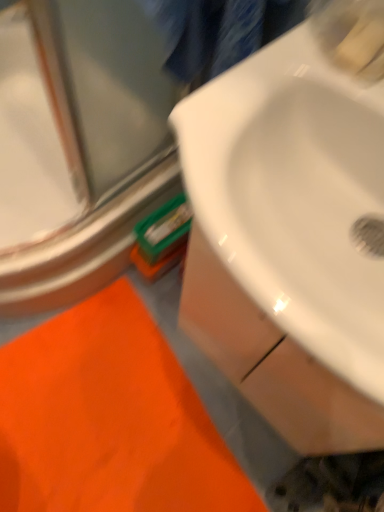
Question: Is orange fabric bath mat at lower left aimed at clear glass door at upper left?

Choices:
 (A) yes
 (B) no

Answer: (B)

Question: Is clear glass door at upper left a part of orange fabric bath mat at lower left?

Choices:
 (A) no
 (B) yes

Answer: (A)

Question: Can you confirm if orange fabric bath mat at lower left is smaller than clear glass door at upper left?

Choices:
 (A) yes
 (B) no

Answer: (A)

Question: Does orange fabric bath mat at lower left have a greater width compared to clear glass door at upper left?

Choices:
 (A) yes
 (B) no

Answer: (B)

Question: From the image's perspective, is orange fabric bath mat at lower left below clear glass door at upper left?

Choices:
 (A) yes
 (B) no

Answer: (A)

Question: From the image's perspective, is orange fabric bath mat at lower left positioned above or below clear glass door at upper left?

Choices:
 (A) below
 (B) above

Answer: (A)

Question: Do you think orange fabric bath mat at lower left is within clear glass door at upper left, or outside of it?

Choices:
 (A) outside
 (B) inside

Answer: (A)

Question: Based on their positions, is orange fabric bath mat at lower left located to the left or right of clear glass door at upper left?

Choices:
 (A) left
 (B) right

Answer: (B)

Question: Considering the positions of orange fabric bath mat at lower left and clear glass door at upper left in the image, is orange fabric bath mat at lower left bigger or smaller than clear glass door at upper left?

Choices:
 (A) small
 (B) big

Answer: (A)

Question: From the image's perspective, is white glossy sink at center above or below orange fabric bath mat at lower left?

Choices:
 (A) below
 (B) above

Answer: (B)

Question: Considering the positions of white glossy sink at center and orange fabric bath mat at lower left in the image, is white glossy sink at center taller or shorter than orange fabric bath mat at lower left?

Choices:
 (A) short
 (B) tall

Answer: (B)

Question: Is point coord(306,228) positioned closer to the camera than point coord(145,433)?

Choices:
 (A) farther
 (B) closer

Answer: (B)

Question: Is white glossy sink at center wider or thinner than orange fabric bath mat at lower left?

Choices:
 (A) wide
 (B) thin

Answer: (B)

Question: In the image, is clear glass door at upper left positioned in front of or behind orange fabric bath mat at lower left?

Choices:
 (A) front
 (B) behind

Answer: (A)

Question: From the image's perspective, relative to orange fabric bath mat at lower left, is clear glass door at upper left above or below?

Choices:
 (A) above
 (B) below

Answer: (A)